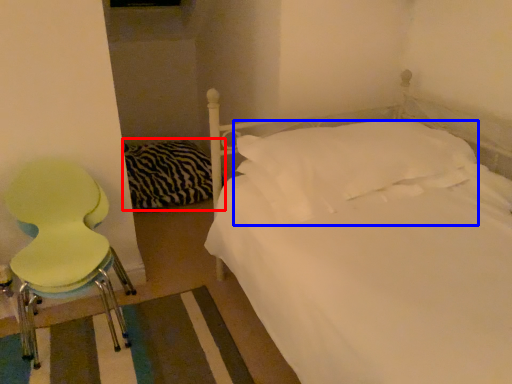
Question: Which point is closer to the camera, bedding (highlighted by a red box) or pillow (highlighted by a blue box)?

Choices:
 (A) bedding
 (B) pillow

Answer: (B)